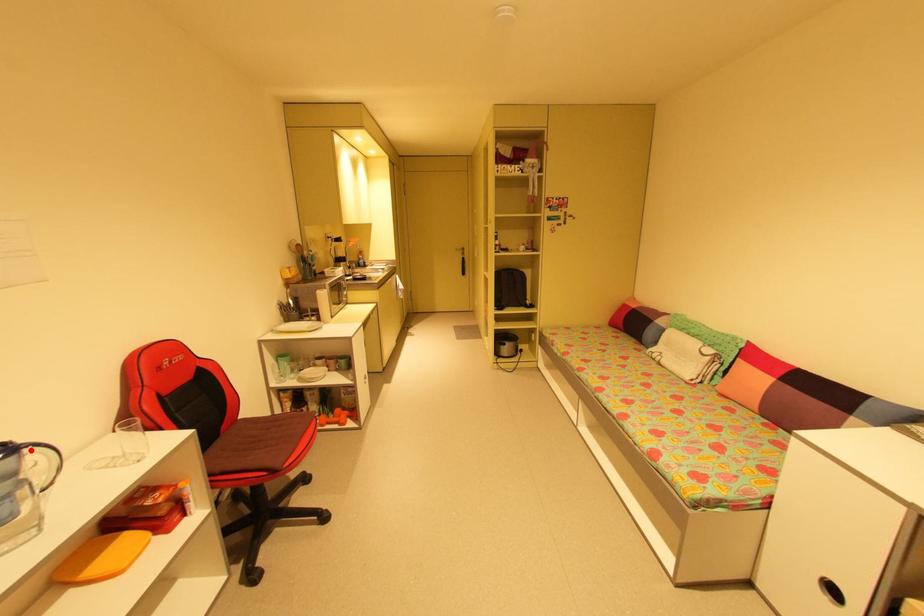
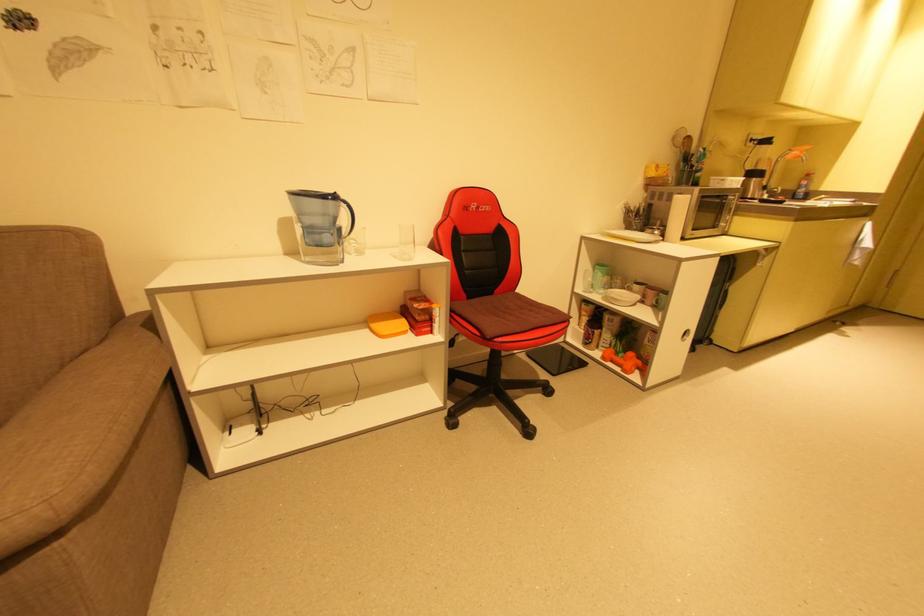
Where in the second image is the point corresponding to the highlighted location from the first image?

(346, 204)